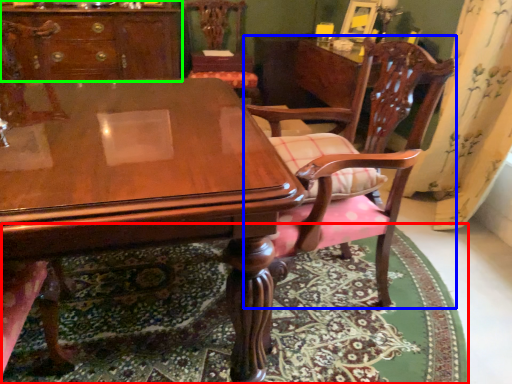
Question: Which object is the farthest from mat (highlighted by a red box)? Choose among these: chair (highlighted by a blue box) or cabinetry (highlighted by a green box).

Choices:
 (A) chair
 (B) cabinetry

Answer: (B)